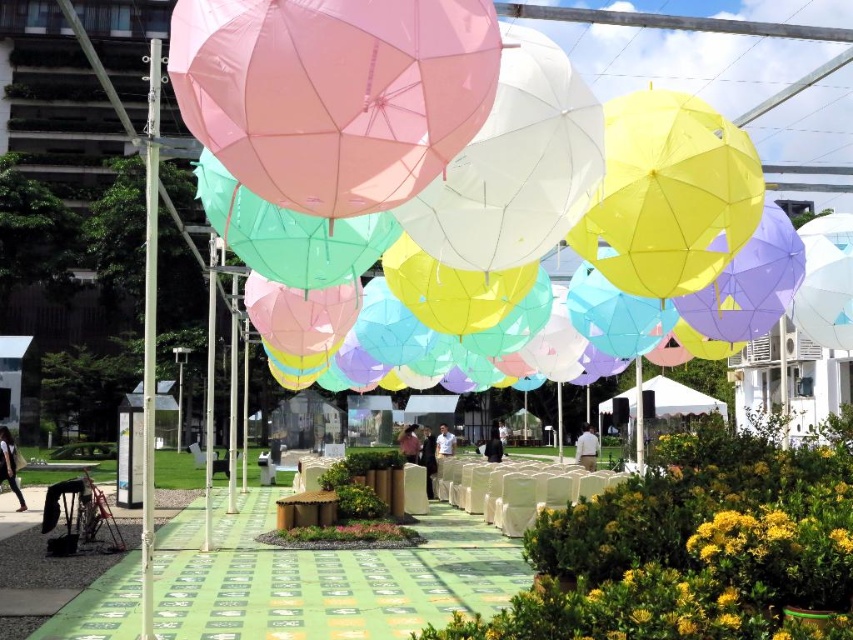
Question: Does matte pink umbrella at upper center have a smaller size compared to white fabric canopy at center?

Choices:
 (A) yes
 (B) no

Answer: (A)

Question: Observing the image, what is the correct spatial positioning of matte pink umbrella at upper center in reference to white fabric canopy at center?

Choices:
 (A) above
 (B) below

Answer: (A)

Question: Which object appears closest to the camera in this image?

Choices:
 (A) matte pink umbrella at upper center
 (B) white fabric canopy at center

Answer: (A)

Question: Is matte pink umbrella at upper center below white fabric canopy at center?

Choices:
 (A) no
 (B) yes

Answer: (A)

Question: Which point is farther to the camera?

Choices:
 (A) white fabric canopy at center
 (B) matte pink umbrella at upper center

Answer: (A)